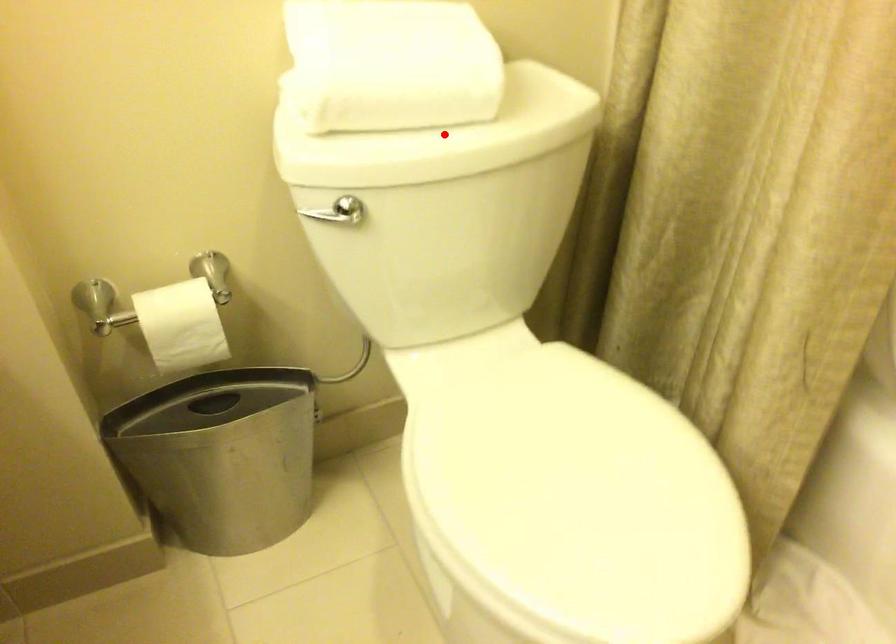
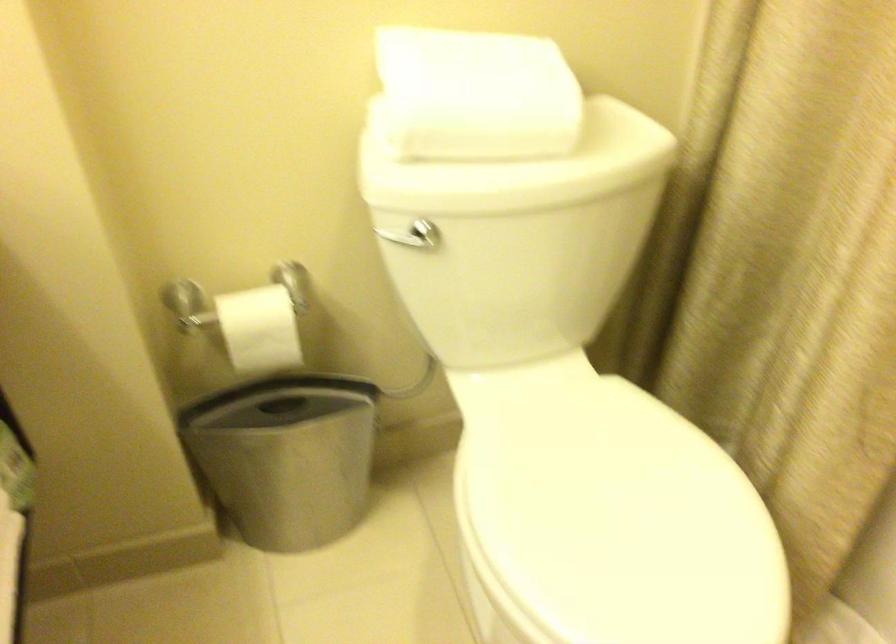
Where in the second image is the point corresponding to the highlighted location from the first image?

(519, 167)